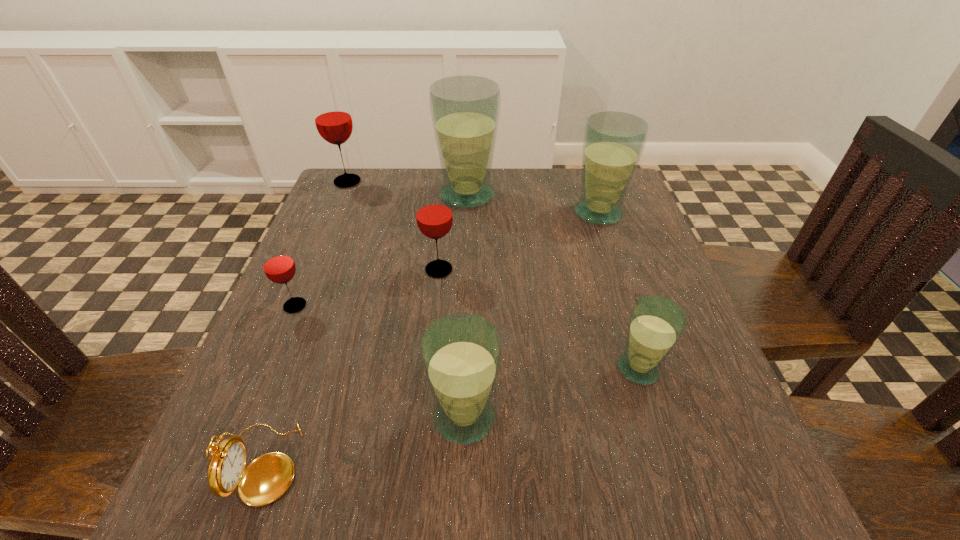
Locate an element on the screen. The height and width of the screenshot is (540, 960). pocket watch is located at coordinates (265, 479).

At what (x,y) coordinates should I click in order to perform the action: click on free space located on the right of the tallest object. Please return your answer as a coordinate pair (x, y). Looking at the image, I should click on (564, 195).

At what (x,y) coordinates should I click in order to perform the action: click on vacant space located on the right of the farthest red glass. Please return your answer as a coordinate pair (x, y). Image resolution: width=960 pixels, height=540 pixels. Looking at the image, I should click on (477, 182).

Locate an element on the screen. The width and height of the screenshot is (960, 540). free location located 0.180m on the front of the third smallest blue glass is located at coordinates (622, 283).

This screenshot has height=540, width=960. I want to click on blank area located 0.090m on the front of the fourth nearest glass, so click(x=434, y=314).

At what (x,y) coordinates should I click in order to perform the action: click on free space located 0.330m on the back of the third biggest blue glass. Please return your answer as a coordinate pair (x, y). This screenshot has width=960, height=540. Looking at the image, I should click on (468, 255).

This screenshot has height=540, width=960. I want to click on vacant space located 0.070m on the back of the smallest red glass, so click(x=309, y=272).

Identify the location of vacant space located on the right of the smallest blue glass. Image resolution: width=960 pixels, height=540 pixels. (698, 368).

The image size is (960, 540). In order to click on vacant space situated on the face of the pocket watch in this screenshot , I will do `click(498, 463)`.

Identify the location of object present at the near edge. (265, 479).